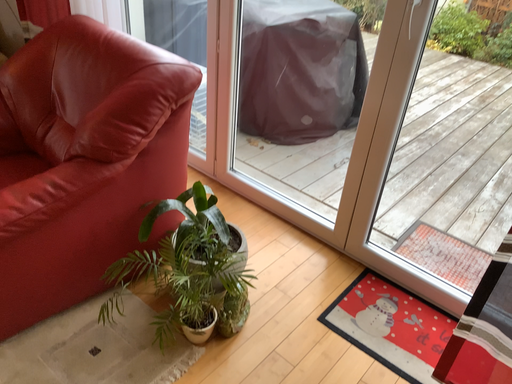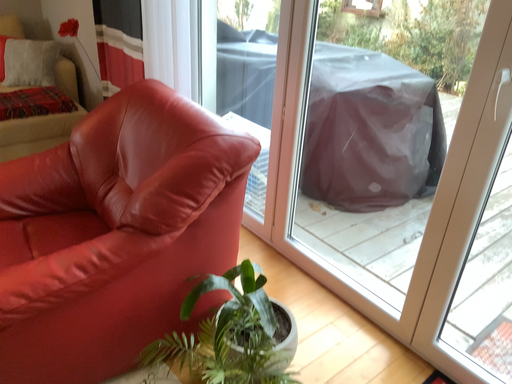
Question: Which way did the camera rotate in the video?

Choices:
 (A) rotated right
 (B) rotated left

Answer: (B)